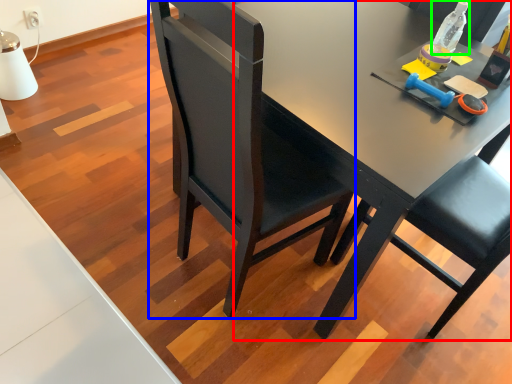
Question: Which object is the closest to the desk (highlighted by a red box)? Choose among these: chair (highlighted by a blue box) or bottle (highlighted by a green box).

Choices:
 (A) chair
 (B) bottle

Answer: (A)